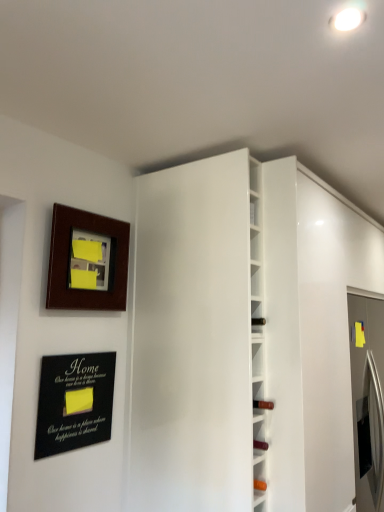
Question: From the image's perspective, is black matte plaque at lower left above white glossy door at center?

Choices:
 (A) no
 (B) yes

Answer: (A)

Question: Is black matte plaque at lower left at the right side of white glossy door at center?

Choices:
 (A) yes
 (B) no

Answer: (B)

Question: Is black matte plaque at lower left looking in the opposite direction of white glossy door at center?

Choices:
 (A) no
 (B) yes

Answer: (A)

Question: Is black matte plaque at lower left bigger than white glossy door at center?

Choices:
 (A) yes
 (B) no

Answer: (B)

Question: Is black matte plaque at lower left at the left side of white glossy door at center?

Choices:
 (A) no
 (B) yes

Answer: (B)

Question: Looking at the image, does white glossy door at center seem bigger or smaller compared to black matte plaque at lower left?

Choices:
 (A) small
 (B) big

Answer: (B)

Question: Is white glossy door at center spatially inside black matte plaque at lower left, or outside of it?

Choices:
 (A) outside
 (B) inside

Answer: (A)

Question: Is white glossy door at center in front of or behind black matte plaque at lower left in the image?

Choices:
 (A) front
 (B) behind

Answer: (A)

Question: Considering the positions of white glossy door at center and black matte plaque at lower left in the image, is white glossy door at center wider or thinner than black matte plaque at lower left?

Choices:
 (A) wide
 (B) thin

Answer: (A)

Question: Would you say white glossy wine rack at center is to the left or to the right of wooden picture frame at upper left in the picture?

Choices:
 (A) left
 (B) right

Answer: (B)

Question: Is white glossy wine rack at center in front of or behind wooden picture frame at upper left in the image?

Choices:
 (A) front
 (B) behind

Answer: (A)

Question: In terms of size, does white glossy wine rack at center appear bigger or smaller than wooden picture frame at upper left?

Choices:
 (A) small
 (B) big

Answer: (B)

Question: In terms of height, does white glossy wine rack at center look taller or shorter compared to wooden picture frame at upper left?

Choices:
 (A) tall
 (B) short

Answer: (A)

Question: In the image, is black matte plaque at lower left positioned in front of or behind white glossy wine rack at center?

Choices:
 (A) behind
 (B) front

Answer: (A)

Question: Considering the relative positions of black matte plaque at lower left and white glossy wine rack at center in the image provided, is black matte plaque at lower left to the left or to the right of white glossy wine rack at center?

Choices:
 (A) left
 (B) right

Answer: (A)